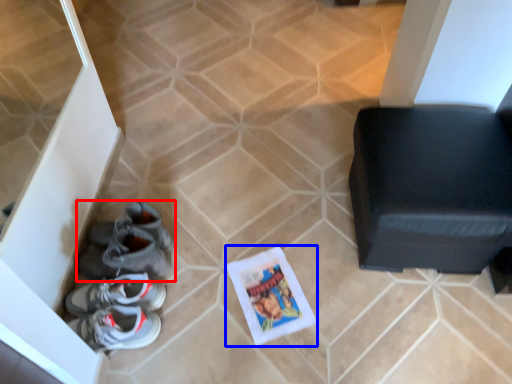
Question: Which of the following is the farthest to the observer, footwear (highlighted by a red box) or comic book (highlighted by a blue box)?

Choices:
 (A) footwear
 (B) comic book

Answer: (B)